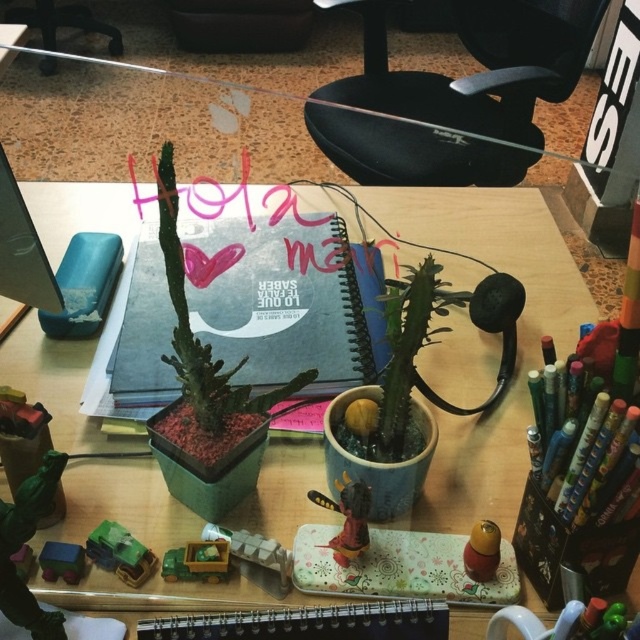
Is shiny plastic bee at center to the left of matte brown rubber stamp at center from the viewer's perspective?

Indeed, shiny plastic bee at center is positioned on the left side of matte brown rubber stamp at center.

Is shiny plastic bee at center bigger than matte brown rubber stamp at center?

Correct, shiny plastic bee at center is larger in size than matte brown rubber stamp at center.

Who is more distant from viewer, (328, 506) or (477, 529)?

The point (328, 506) is more distant.

The width and height of the screenshot is (640, 640). What are the coordinates of `shiny plastic bee at center` in the screenshot? It's located at (346, 518).

Can you confirm if matte plastic desk at center is smaller than blue matte notebook at center?

Incorrect, matte plastic desk at center is not smaller in size than blue matte notebook at center.

Between matte plastic desk at center and blue matte notebook at center, which one is positioned higher?

blue matte notebook at center is above.

Image resolution: width=640 pixels, height=640 pixels. What do you see at coordinates (516, 339) in the screenshot?
I see `matte plastic desk at center` at bounding box center [516, 339].

In order to click on matte plastic desk at center in this screenshot , I will do `click(516, 339)`.

Which of these two, blue rubber at upper left or shiny plastic bee at center, stands shorter?

shiny plastic bee at center

Image resolution: width=640 pixels, height=640 pixels. In order to click on blue rubber at upper left in this screenshot , I will do `click(84, 285)`.

The width and height of the screenshot is (640, 640). I want to click on blue rubber at upper left, so click(84, 285).